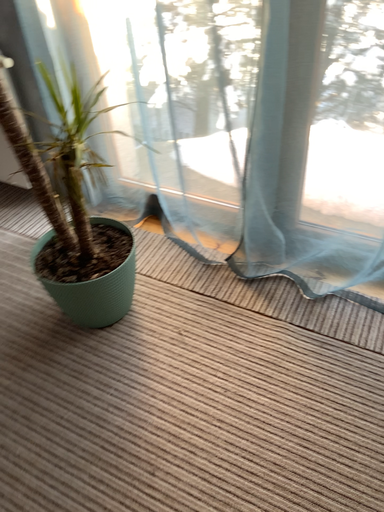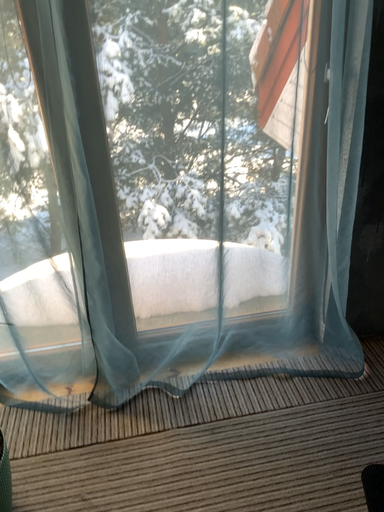
Question: Which way did the camera rotate in the video?

Choices:
 (A) rotated downward
 (B) rotated upward

Answer: (B)